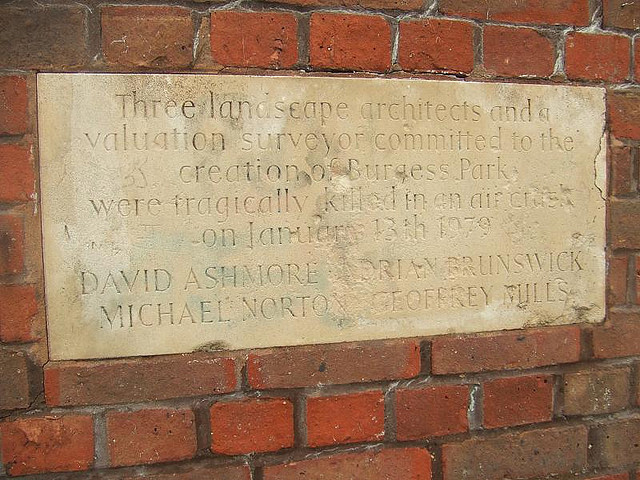
Where is `beige plaque`? beige plaque is located at coordinates (310, 190).